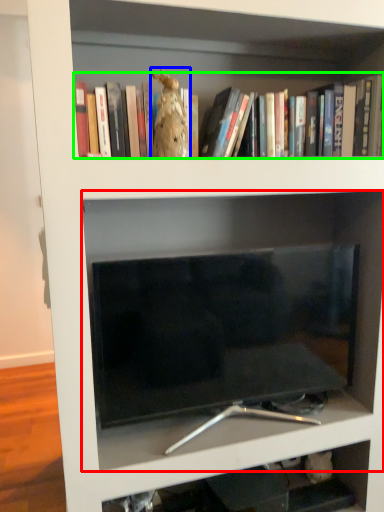
Question: Based on their relative distances, which object is nearer to shelf (highlighted by a red box)? Choose from animal (highlighted by a blue box) and book (highlighted by a green box).

Choices:
 (A) animal
 (B) book

Answer: (B)